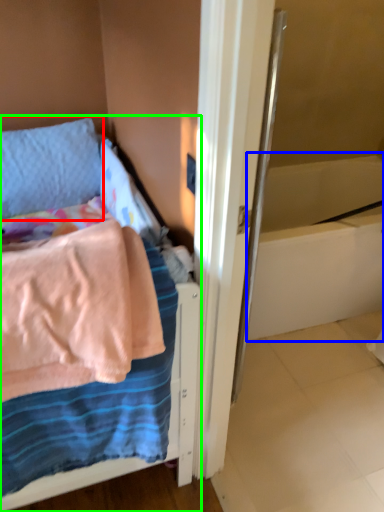
Question: Estimate the real-world distances between objects in this image. Which object is closer to pillow (highlighted by a red box), bath (highlighted by a blue box) or bed (highlighted by a green box)?

Choices:
 (A) bath
 (B) bed

Answer: (B)